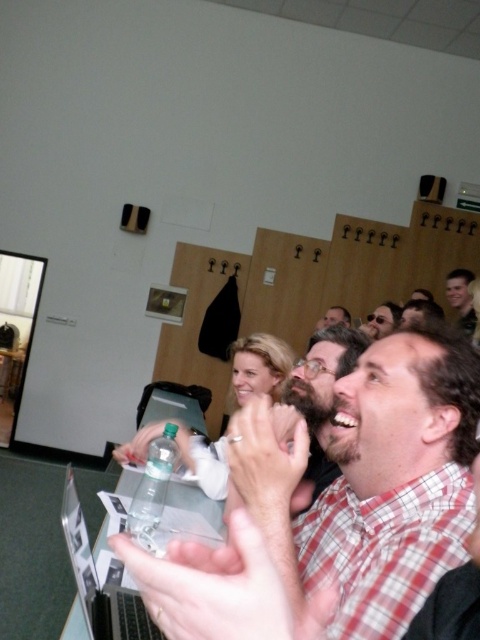
Which of these two, plaid shirt at center or light brown hair at upper right, stands shorter?

light brown hair at upper right

The height and width of the screenshot is (640, 480). What do you see at coordinates (371, 483) in the screenshot?
I see `plaid shirt at center` at bounding box center [371, 483].

Which is in front, point (450, 394) or point (451, 282)?

Point (450, 394)

Locate an element on the screen. This screenshot has width=480, height=640. plaid shirt at center is located at coordinates (371, 483).

Is plaid shirt at center thinner than silver metallic laptop at center?

In fact, plaid shirt at center might be wider than silver metallic laptop at center.

What do you see at coordinates (371, 483) in the screenshot? The image size is (480, 640). I see `plaid shirt at center` at bounding box center [371, 483].

Describe the element at coordinates (371, 483) in the screenshot. I see `plaid shirt at center` at that location.

At what (x,y) coordinates should I click in order to perform the action: click on plaid shirt at center. Please return your answer as a coordinate pair (x, y). Image resolution: width=480 pixels, height=640 pixels. Looking at the image, I should click on (x=371, y=483).

Between silver metallic laptop at center and matte black sunglasses at upper center, which one has more height?

matte black sunglasses at upper center is taller.

Does silver metallic laptop at center have a greater height compared to matte black sunglasses at upper center?

No, silver metallic laptop at center is not taller than matte black sunglasses at upper center.

Locate an element on the screen. silver metallic laptop at center is located at coordinates (196, 504).

This screenshot has height=640, width=480. I want to click on silver metallic laptop at center, so click(x=196, y=504).